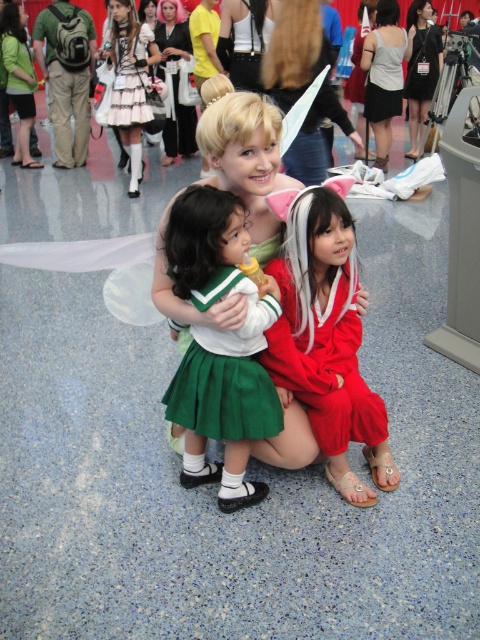
Can you confirm if green satin skirt at center is smaller than matte black dress at upper left?

Indeed, green satin skirt at center has a smaller size compared to matte black dress at upper left.

Is green satin skirt at center to the left of matte black dress at upper left from the viewer's perspective?

Incorrect, green satin skirt at center is not on the left side of matte black dress at upper left.

Is point (203, 340) farther from viewer compared to point (132, 193)?

That is False.

At what (x,y) coordinates should I click in order to perform the action: click on green satin skirt at center. Please return your answer as a coordinate pair (x, y). Looking at the image, I should click on pyautogui.click(x=227, y=369).

Is point (282, 305) more distant than point (144, 96)?

No, (282, 305) is closer to viewer.

Between matte red dress at center and matte black dress at upper left, which one has less height?

With less height is matte red dress at center.

Is point (340, 353) positioned in front of point (139, 157)?

Yes.

Locate an element on the screen. This screenshot has height=640, width=480. matte red dress at center is located at coordinates (324, 364).

Is the position of matte red dress at center less distant than that of green satin skirt at center?

No, matte red dress at center is behind green satin skirt at center.

Where is `matte red dress at center`? This screenshot has height=640, width=480. matte red dress at center is located at coordinates (324, 364).

Where is `matte red dress at center`? The height and width of the screenshot is (640, 480). matte red dress at center is located at coordinates (324, 364).